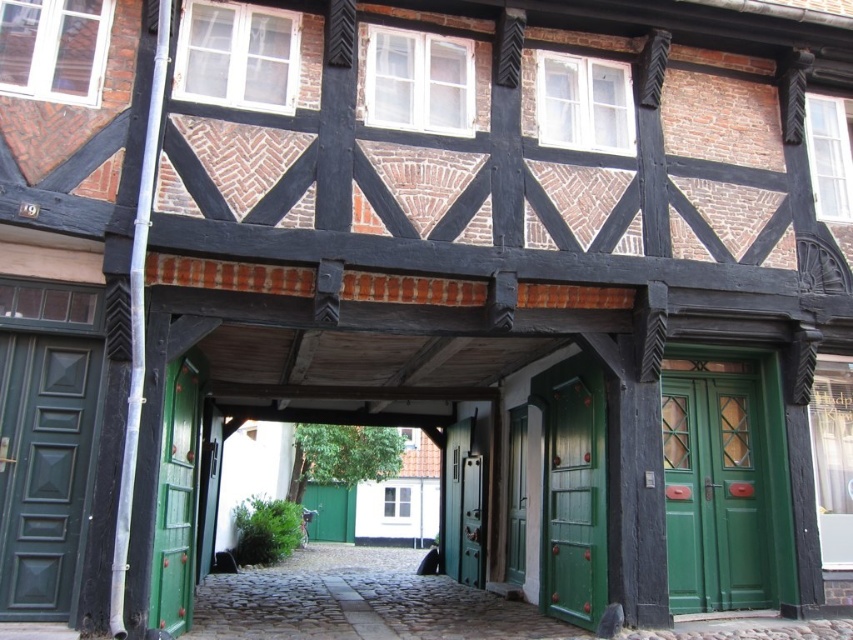
You are a delivery person carrying a package that requires a 6.5 meter clearance to pass through a doorway. You arrive at the building and see the green matte door at left and the green glossy door at center. Can you fit your package through the space between these two doors?

The space between the green matte door at left and green glossy door at center is 6.43 meters, which is slightly less than the required 6.5 meters clearance. Therefore, the package cannot fit through the space between these two doors.

You are standing in front of the half timbered building and want to enter through the green wooden door at left and the metallic silver door at center. Which door should you approach first from your current position?

The green wooden door at left is to the left of the metallic silver door at center, so you should approach the green wooden door at left first since it is on the left side.

Looking at this image, you are a delivery person trying to enter the building through the green wooden door at left and the metallic silver door at center. Which door should you use if you need to access the lower level?

The metallic silver door at center is the correct one for accessing the lower level because the green wooden door at left is above it, likely leading to an upper floor.